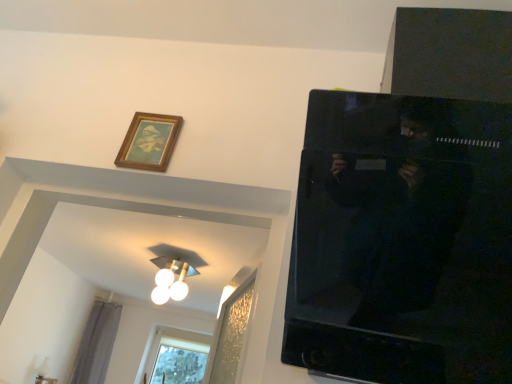
This screenshot has height=384, width=512. I want to click on white glossy light fixture at upper center, so click(170, 279).

What do you see at coordinates (172, 347) in the screenshot? This screenshot has height=384, width=512. I see `clear glass window at lower left` at bounding box center [172, 347].

Locate an element on the screen. This screenshot has height=384, width=512. wooden picture frame at upper left is located at coordinates (149, 142).

What is the approximate height of wooden picture frame at upper left?

The height of wooden picture frame at upper left is 20.45 centimeters.

At what (x,y) coordinates should I click in order to perform the action: click on white glossy light fixture at upper center. Please return your answer as a coordinate pair (x, y). This screenshot has height=384, width=512. Looking at the image, I should click on (170, 279).

Is gray fabric curtain at lower left touching clear glass window at lower left?

No.

Is gray fabric curtain at lower left inside or outside of clear glass window at lower left?

gray fabric curtain at lower left exists outside the volume of clear glass window at lower left.

From a real-world perspective, is gray fabric curtain at lower left physically located above or below clear glass window at lower left?

From a real-world perspective, gray fabric curtain at lower left is physically below clear glass window at lower left.

Who is bigger, clear glass window at lower left or gray fabric curtain at lower left?

With larger size is clear glass window at lower left.

Is gray fabric curtain at lower left completely or partially inside clear glass window at lower left?

Definitely not — gray fabric curtain at lower left is not inside clear glass window at lower left.

Are clear glass window at lower left and gray fabric curtain at lower left beside each other?

No, clear glass window at lower left is not next to gray fabric curtain at lower left.

Which of these two, wooden picture frame at upper left or gray fabric curtain at lower left, is thinner?

Thinner between the two is wooden picture frame at upper left.

Image resolution: width=512 pixels, height=384 pixels. What are the coordinates of `curtain located below the wooden picture frame at upper left (from the image's perspective)` in the screenshot? It's located at (97, 344).

Could you tell me if wooden picture frame at upper left is turned towards gray fabric curtain at lower left?

No, wooden picture frame at upper left does not turn towards gray fabric curtain at lower left.

Considering the positions of objects wooden picture frame at upper left and gray fabric curtain at lower left in the image provided, who is more to the right, wooden picture frame at upper left or gray fabric curtain at lower left?

wooden picture frame at upper left is more to the right.

Which object is further away from the camera taking this photo, white glossy light fixture at upper center or wooden picture frame at upper left?

white glossy light fixture at upper center is further from the camera.

Between white glossy light fixture at upper center and wooden picture frame at upper left, which one has larger size?

white glossy light fixture at upper center is bigger.

From the image's perspective, which object appears higher, white glossy light fixture at upper center or wooden picture frame at upper left?

wooden picture frame at upper left is shown above in the image.

From a real-world perspective, relative to wooden picture frame at upper left, is white glossy light fixture at upper center vertically above or below?

white glossy light fixture at upper center is above wooden picture frame at upper left.

Would you say clear glass window at lower left is inside or outside wooden picture frame at upper left?

clear glass window at lower left is located beyond the bounds of wooden picture frame at upper left.

Looking at this image, is clear glass window at lower left not close to wooden picture frame at upper left?

That's right, there is a large distance between clear glass window at lower left and wooden picture frame at upper left.

Is clear glass window at lower left oriented towards wooden picture frame at upper left?

Yes, clear glass window at lower left is turned towards wooden picture frame at upper left.

Considering the sizes of clear glass window at lower left and wooden picture frame at upper left in the image, is clear glass window at lower left bigger or smaller than wooden picture frame at upper left?

Clearly, clear glass window at lower left is larger in size than wooden picture frame at upper left.

Between wooden picture frame at upper left and clear glass window at lower left, which one has larger width?

clear glass window at lower left is wider.

Considering the relative sizes of wooden picture frame at upper left and clear glass window at lower left in the image provided, is wooden picture frame at upper left smaller than clear glass window at lower left?

Correct, wooden picture frame at upper left occupies less space than clear glass window at lower left.

Which object is further away from the camera taking this photo, wooden picture frame at upper left or clear glass window at lower left?

clear glass window at lower left is further from the camera.

From the image's perspective, is gray fabric curtain at lower left over wooden picture frame at upper left?

No, from the image's perspective, gray fabric curtain at lower left is not above wooden picture frame at upper left.

Does gray fabric curtain at lower left have a lesser width compared to wooden picture frame at upper left?

No.

You are a GUI agent. You are given a task and a screenshot of the screen. Output one action in this format:
    pyautogui.click(x=<x>, y=<y>)
    Task: Click on the picture frame on the right of gray fabric curtain at lower left
    
    Given the screenshot: What is the action you would take?
    pyautogui.click(x=149, y=142)

Which object is positioned more to the left, gray fabric curtain at lower left or wooden picture frame at upper left?

gray fabric curtain at lower left.

Locate an element on the screen. The image size is (512, 384). window lying behind the gray fabric curtain at lower left is located at coordinates (172, 347).

You are a GUI agent. You are given a task and a screenshot of the screen. Output one action in this format:
    pyautogui.click(x=<x>, y=<y>)
    Task: Click on the window below the gray fabric curtain at lower left (from the image's perspective)
    The image size is (512, 384).
    Given the screenshot: What is the action you would take?
    pyautogui.click(x=172, y=347)

When comparing their distances from gray fabric curtain at lower left, does white glossy light fixture at upper center or clear glass window at lower left seem further?

white glossy light fixture at upper center is further to gray fabric curtain at lower left.

Which object lies nearer to the anchor point clear glass window at lower left, white glossy light fixture at upper center or gray fabric curtain at lower left?

Among the two, gray fabric curtain at lower left is located nearer to clear glass window at lower left.

Which object lies nearer to the anchor point gray fabric curtain at lower left, clear glass window at lower left or wooden picture frame at upper left?

clear glass window at lower left lies closer to gray fabric curtain at lower left than the other object.

From the image, which object appears to be farther from wooden picture frame at upper left, gray fabric curtain at lower left or white glossy light fixture at upper center?

gray fabric curtain at lower left is positioned further to the anchor wooden picture frame at upper left.

Based on their spatial positions, is white glossy light fixture at upper center or gray fabric curtain at lower left closer to wooden picture frame at upper left?

white glossy light fixture at upper center lies closer to wooden picture frame at upper left than the other object.

Looking at this image, from the image, which object appears to be nearer to white glossy light fixture at upper center, gray fabric curtain at lower left or clear glass window at lower left?

clear glass window at lower left lies closer to white glossy light fixture at upper center than the other object.

Considering their positions, is white glossy light fixture at upper center positioned further to wooden picture frame at upper left than clear glass window at lower left?

Among the two, clear glass window at lower left is located further to wooden picture frame at upper left.

When comparing their distances from clear glass window at lower left, does gray fabric curtain at lower left or wooden picture frame at upper left seem further?

wooden picture frame at upper left lies further to clear glass window at lower left than the other object.

What are the coordinates of `curtain between white glossy light fixture at upper center and clear glass window at lower left from front to back` in the screenshot? It's located at (97, 344).

Identify the location of light fixture located between wooden picture frame at upper left and gray fabric curtain at lower left in the depth direction. (170, 279).

You are a GUI agent. You are given a task and a screenshot of the screen. Output one action in this format:
    pyautogui.click(x=<x>, y=<y>)
    Task: Click on the curtain between wooden picture frame at upper left and clear glass window at lower left along the z-axis
    This screenshot has height=384, width=512.
    Given the screenshot: What is the action you would take?
    pyautogui.click(x=97, y=344)

Locate an element on the screen. This screenshot has width=512, height=384. light fixture between wooden picture frame at upper left and clear glass window at lower left in the front-back direction is located at coordinates (170, 279).